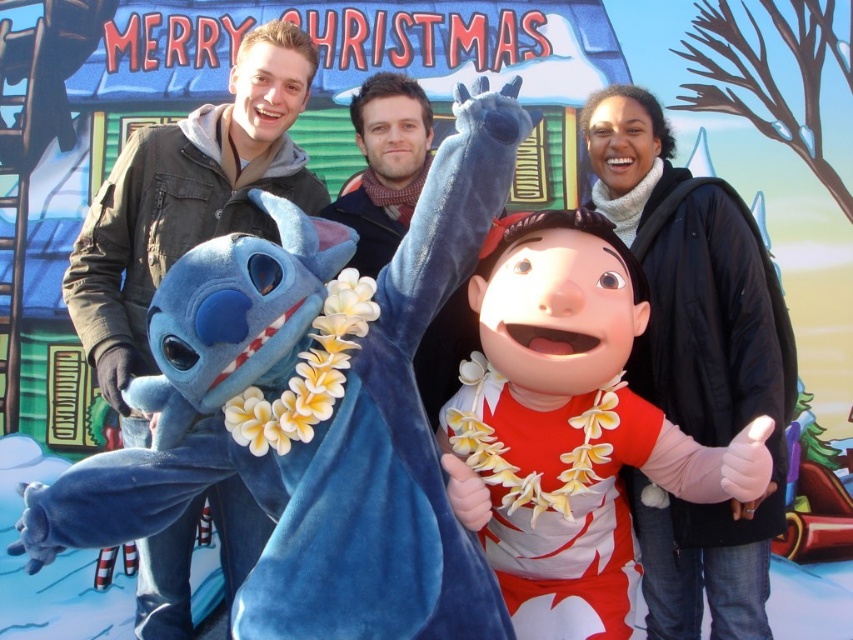
You are a photographer setting up for a group photo. You have a matte black jacket at upper right and a matte black hoodie at left. The backdrop is 10 meters away. Can you position both items so they are closer to the backdrop than to each other?

The distance between the matte black jacket at upper right and the matte black hoodie at left is 6.53 meters. To be closer to the backdrop than to each other, the total distance from each item to the backdrop must be less than half of 6.53 meters, which is 3.265 meters. However, since the backdrop is 10 meters away, it is impossible to position them closer to the backdrop than to each other.

In the festive scene described, there are two clothing items present. The first is a matte red dress at center, and the second is a matte black jacket at upper right. Based on their positions, which clothing item is positioned to the left of the other?

The matte red dress at center is to the left of the matte black jacket at upper right.